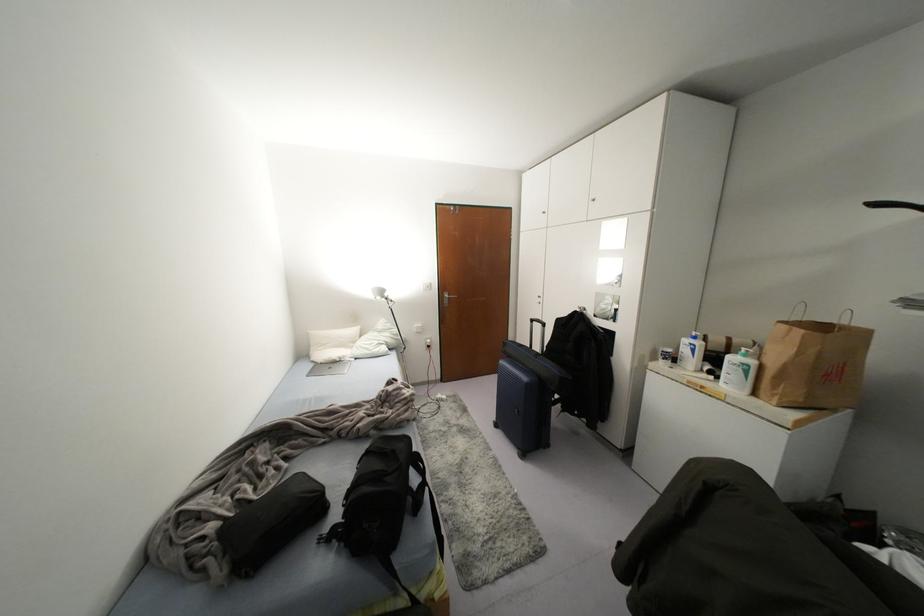
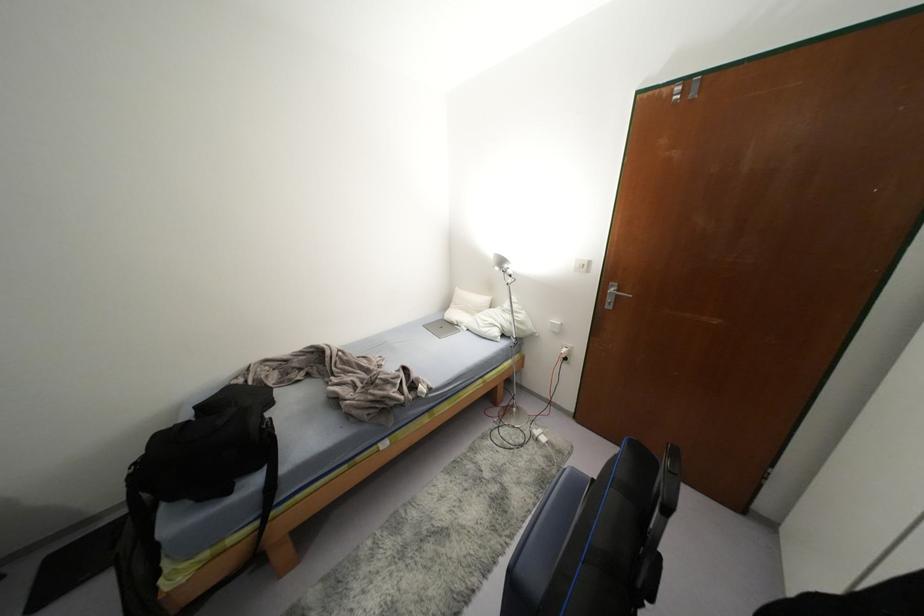
In the second image, find the point that corresponds to the point at 385,294 in the first image.

(505, 265)